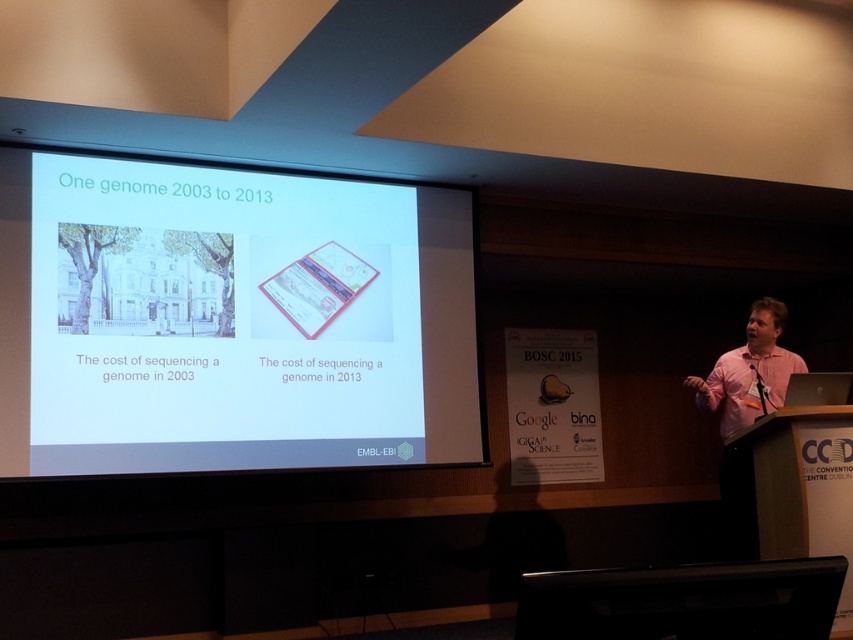
You are standing in the presentation room and see two points marked on the projection screen. The first point is at coordinates point (x=227, y=408) and the second is at point (x=773, y=332). From your perspective, which point appears closer to you on the screen?

Point (x=227, y=408) is in front of point (x=773, y=332), so it appears closer to you on the screen.

You are an attendee at this presentation. You notice the white paper at center and the pink shirt at right. Which object is covering the other one?

The white paper at center is positioned over the pink shirt at right, meaning it is covering the shirt.

In the scene shown: You are sitting in the front row of the presentation. You notice the white paper at center and the pink shirt at right. Which object is nearer to you?

The white paper at center is closer to the viewer than the pink shirt at right.